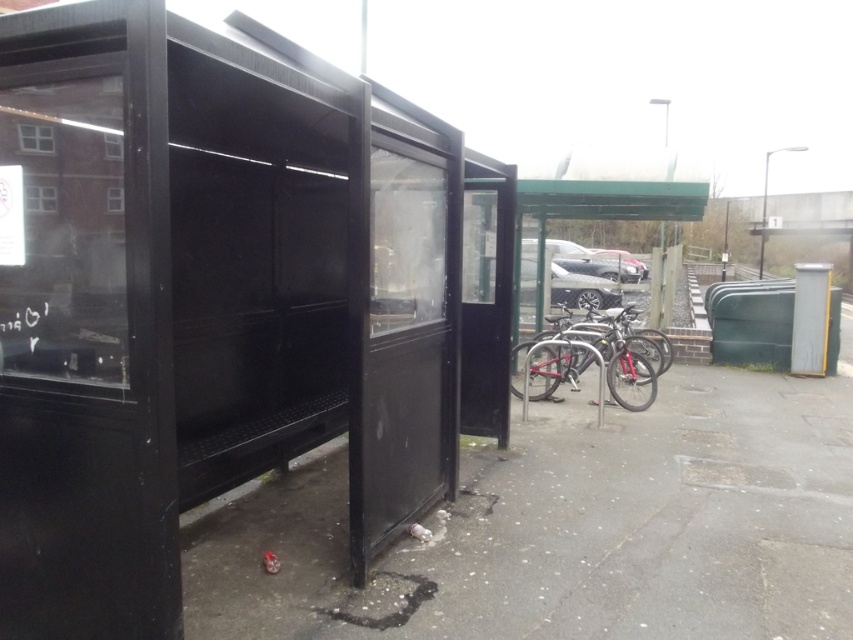
Question: Which object appears closest to the camera in this image?

Choices:
 (A) black matte bus stop at left
 (B) shiny metallic bicycle at center

Answer: (A)

Question: Is black matte bus stop at left to the left of shiny metallic bicycle at center from the viewer's perspective?

Choices:
 (A) no
 (B) yes

Answer: (B)

Question: Among these objects, which one is farthest from the camera?

Choices:
 (A) shiny metallic bicycle at center
 (B) black matte bus stop at left

Answer: (A)

Question: Does black matte bus stop at left appear on the left side of shiny metallic bicycle at center?

Choices:
 (A) yes
 (B) no

Answer: (A)

Question: Does black matte bus stop at left have a smaller size compared to shiny metallic bicycle at center?

Choices:
 (A) yes
 (B) no

Answer: (B)

Question: Among these objects, which one is nearest to the camera?

Choices:
 (A) shiny metallic bicycle at center
 (B) black matte bus stop at left

Answer: (B)